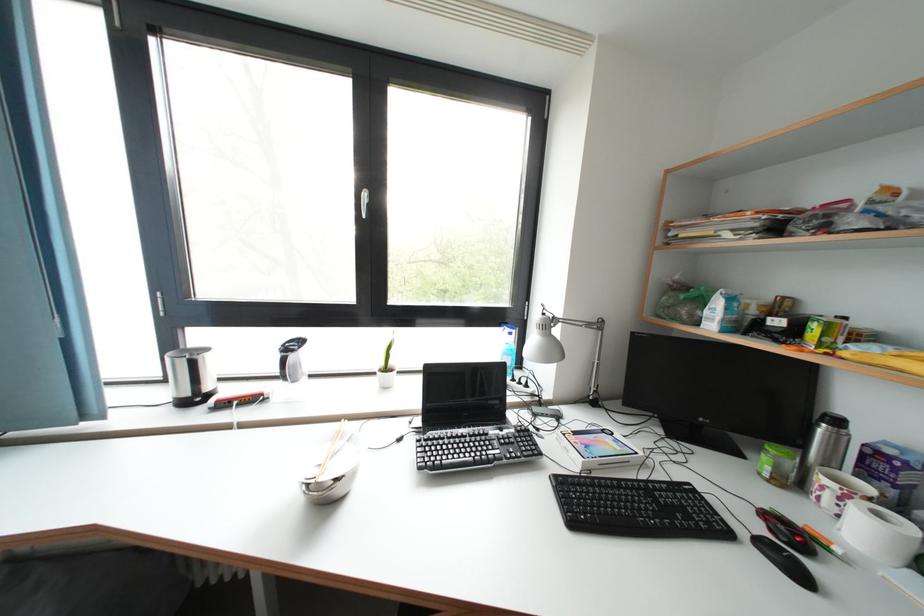
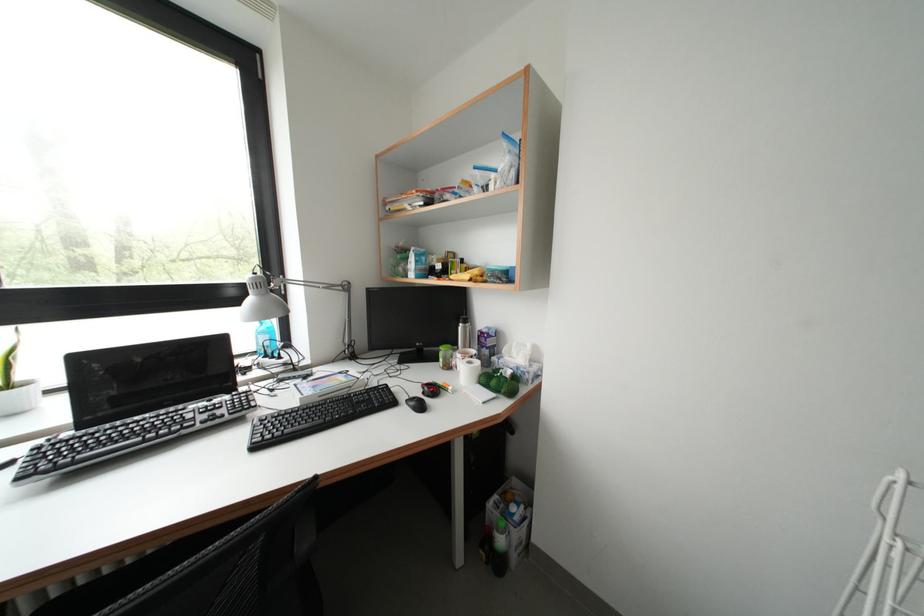
The point at [827,436] is marked in the first image. Where is the corresponding point in the second image?

(467, 333)